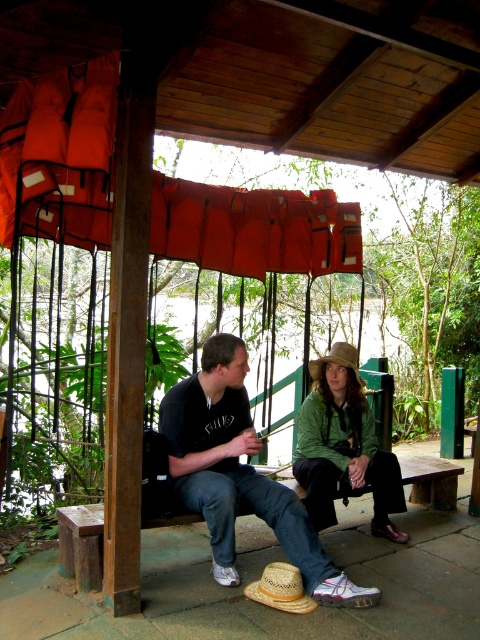
Which of these two, matte black shirt at center or strawmaterial/texturehat at lower center, stands taller?

With more height is matte black shirt at center.

Measure the distance from matte black shirt at center to strawmaterial/texturehat at lower center.

matte black shirt at center is 15.70 inches away from strawmaterial/texturehat at lower center.

Who is more distant from viewer, (223,348) or (300,579)?

The point (223,348) is behind.

Locate an element on the screen. matte black shirt at center is located at coordinates (240, 474).

Between wooden bench at center and strawmaterial/texturehat at lower center, which one is positioned higher?

wooden bench at center is above.

Does wooden bench at center have a lesser height compared to strawmaterial/texturehat at lower center?

No, wooden bench at center is not shorter than strawmaterial/texturehat at lower center.

Where is `wooden bench at center`? The height and width of the screenshot is (640, 480). wooden bench at center is located at coordinates (82, 545).

Which is in front, point (380, 528) or point (85, 556)?

Positioned in front is point (85, 556).

Can you confirm if green matte jacket at center is positioned above wooden bench at center?

Yes.

The height and width of the screenshot is (640, 480). Find the location of `green matte jacket at center`. green matte jacket at center is located at coordinates (344, 445).